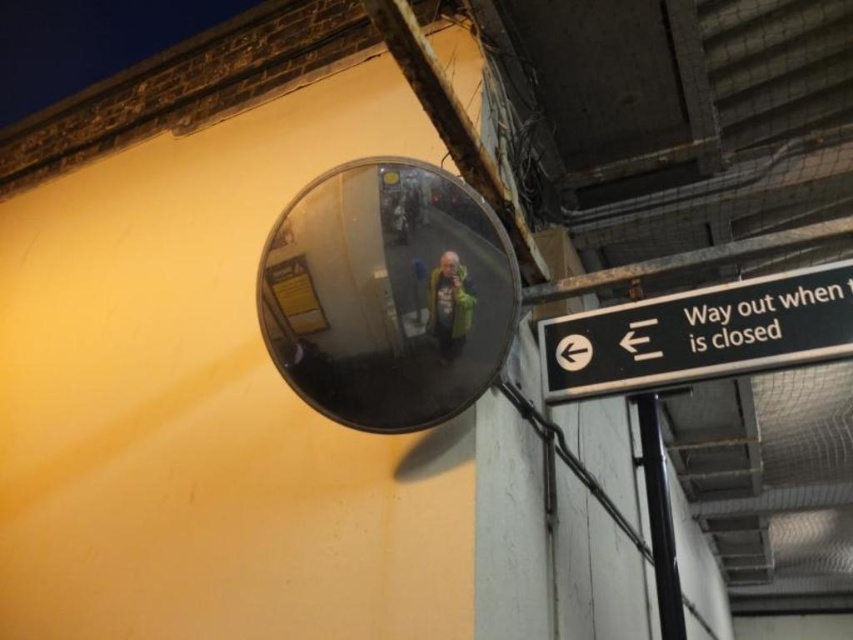
You are a maintenance worker needing to clean both the transparent glass mirror at upper center and the black plastic sign at upper right. If your cleaning spray can reach up to 21 inches, can you clean both objects from your current position without moving closer?

The distance between the transparent glass mirror at upper center and the black plastic sign at upper right is 20.95 inches, which is just under the spray can reach of 21 inches. Therefore, you can clean both objects from your current position without moving closer.

You are standing in front of the convex mirror in the subway station. You notice two points marked on the wall. One is at coordinate point (436, 394) and the other is at point (648, 468). Which point is closer to your current position?

Point (436, 394) is closer to the camera than point (648, 468), so the point at (436, 394) is closer to your current position.

You are standing in front of the convex mirror in the subway station. You see a point marked at coordinates [700,333]. Which object does this point correspond to?

The point at coordinates [700,333] corresponds to the black plastic sign at upper right.